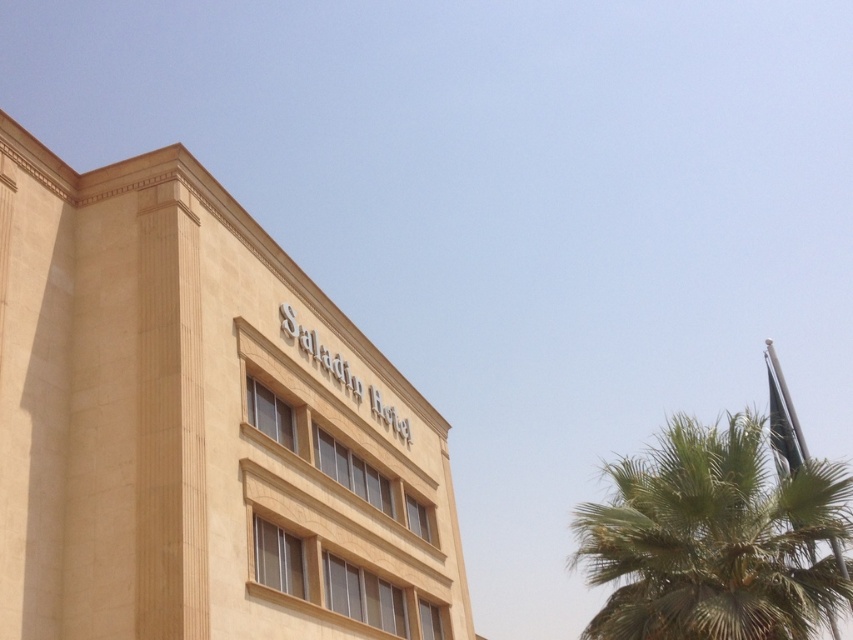
Question: Which point is farther from the camera taking this photo?

Choices:
 (A) (680, 608)
 (B) (344, 524)

Answer: (B)

Question: In this image, where is beige stone saladin hotel at upper center located relative to green leafy palm tree at right?

Choices:
 (A) below
 (B) above

Answer: (B)

Question: Which point appears closest to the camera in this image?

Choices:
 (A) (28, 342)
 (B) (775, 545)

Answer: (B)

Question: Does beige stone saladin hotel at upper center appear over green leafy palm tree at right?

Choices:
 (A) yes
 (B) no

Answer: (A)

Question: Considering the relative positions of beige stone saladin hotel at upper center and green leafy palm tree at right in the image provided, where is beige stone saladin hotel at upper center located with respect to green leafy palm tree at right?

Choices:
 (A) above
 (B) below

Answer: (A)